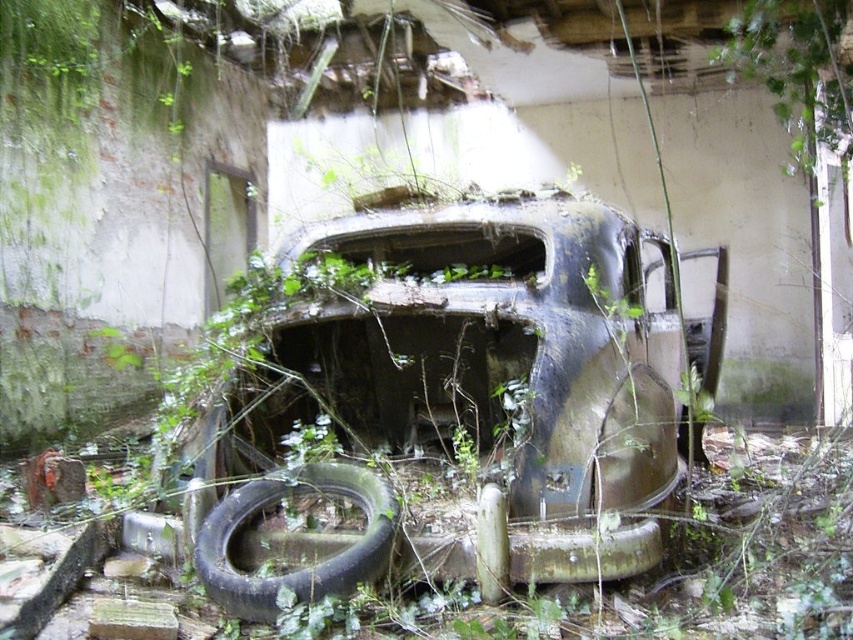
Which is more to the left, rusty metal car at center or black rubber tire at lower left?

black rubber tire at lower left is more to the left.

Does rusty metal car at center appear on the right side of black rubber tire at lower left?

Yes, rusty metal car at center is to the right of black rubber tire at lower left.

Between point (479, 536) and point (351, 579), which one is positioned behind?

Point (479, 536)

Locate an element on the screen. The image size is (853, 640). rusty metal car at center is located at coordinates (444, 408).

Is rusty metal car at center smaller than green leafy vines at upper center?

Incorrect, rusty metal car at center is not smaller in size than green leafy vines at upper center.

Who is more forward, (173, 508) or (750, 58)?

Point (173, 508)

The image size is (853, 640). I want to click on rusty metal car at center, so click(x=444, y=408).

Which is behind, point (383, 486) or point (804, 93)?

The point (804, 93) is behind.

Who is positioned more to the right, black rubber tire at lower left or green leafy vines at upper center?

Positioned to the right is green leafy vines at upper center.

Does point (238, 602) come farther from viewer compared to point (828, 36)?

No.

Where is `black rubber tire at lower left`? Image resolution: width=853 pixels, height=640 pixels. black rubber tire at lower left is located at coordinates (302, 566).